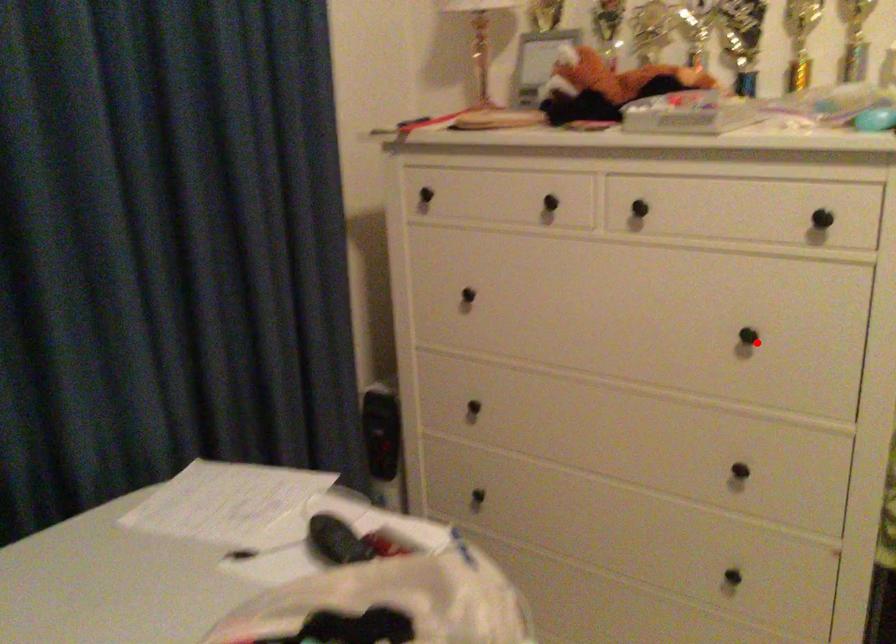
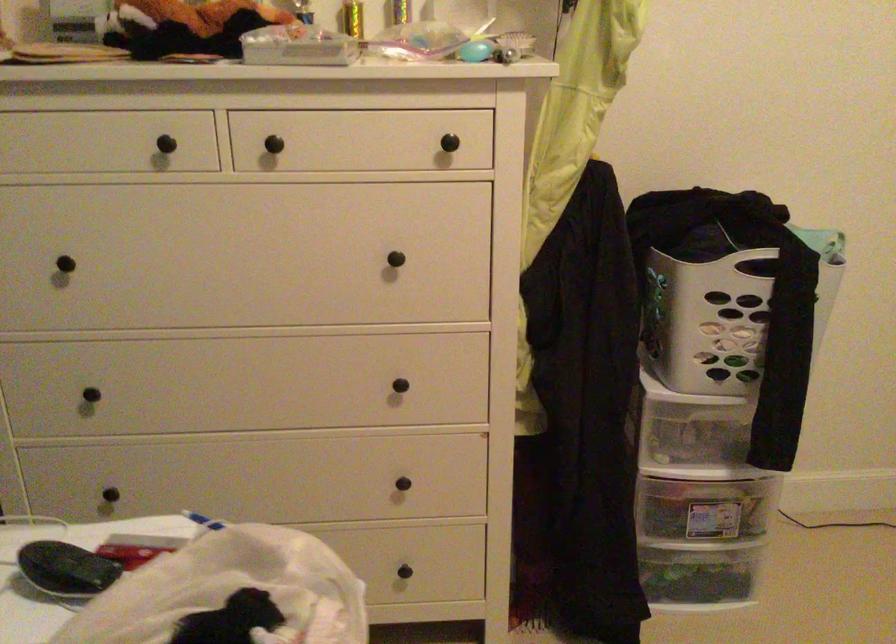
The point at the highlighted location is marked in the first image. Where is the corresponding point in the second image?

(400, 261)